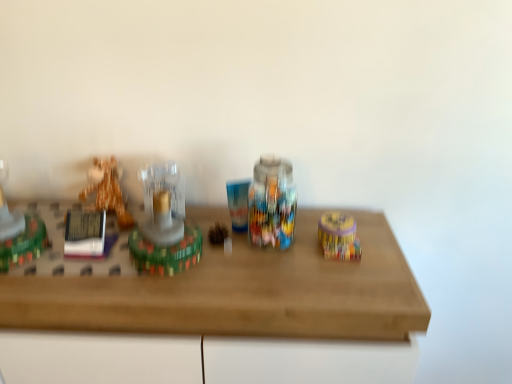
Question: Can you confirm if translucent glass candle at center, placed as the third toy when sorted from left to right, is thinner than matte yellow container at right, which ranks as the 4th toy in left-to-right order?

Choices:
 (A) yes
 (B) no

Answer: (B)

Question: Considering the relative sizes of translucent glass candle at center, placed as the third toy when sorted from left to right, and matte yellow container at right, which ranks as the 4th toy in left-to-right order, in the image provided, is translucent glass candle at center, placed as the third toy when sorted from left to right, taller than matte yellow container at right, which ranks as the 4th toy in left-to-right order,?

Choices:
 (A) yes
 (B) no

Answer: (A)

Question: Considering the relative positions of translucent glass candle at center, placed as the third toy when sorted from left to right, and matte yellow container at right, which ranks as the 4th toy in left-to-right order, in the image provided, is translucent glass candle at center, placed as the third toy when sorted from left to right, behind matte yellow container at right, which ranks as the 4th toy in left-to-right order,?

Choices:
 (A) yes
 (B) no

Answer: (B)

Question: From the image's perspective, is translucent glass candle at center, placed as the third toy when sorted from left to right, located above matte yellow container at right, which ranks as the 4th toy in left-to-right order?

Choices:
 (A) yes
 (B) no

Answer: (A)

Question: Can you confirm if translucent glass candle at center, positioned as the second toy in right-to-left order, is bigger than matte yellow container at right, which ranks as the 4th toy in left-to-right order?

Choices:
 (A) yes
 (B) no

Answer: (A)

Question: Considering the positions of shiny green plastic toy at left, acting as the 1th toy starting from the left, and wooden table at center in the image, is shiny green plastic toy at left, acting as the 1th toy starting from the left, wider or thinner than wooden table at center?

Choices:
 (A) thin
 (B) wide

Answer: (A)

Question: From a real-world perspective, is shiny green plastic toy at left, acting as the 1th toy starting from the left, positioned above or below wooden table at center?

Choices:
 (A) above
 (B) below

Answer: (A)

Question: From their relative heights in the image, would you say shiny green plastic toy at left, acting as the 1th toy starting from the left, is taller or shorter than wooden table at center?

Choices:
 (A) tall
 (B) short

Answer: (B)

Question: In terms of size, does shiny green plastic toy at left, which appears as the 4th toy when viewed from the right, appear bigger or smaller than wooden table at center?

Choices:
 (A) small
 (B) big

Answer: (A)

Question: Is wooden table at center taller or shorter than shiny green plastic toy at left, acting as the 1th toy starting from the left?

Choices:
 (A) short
 (B) tall

Answer: (B)

Question: Is wooden table at center spatially inside shiny green plastic toy at left, which appears as the 4th toy when viewed from the right, or outside of it?

Choices:
 (A) outside
 (B) inside

Answer: (A)

Question: Is point (423, 306) closer or farther from the camera than point (0, 226)?

Choices:
 (A) closer
 (B) farther

Answer: (A)

Question: From a real-world perspective, relative to shiny green plastic toy at left, which appears as the 4th toy when viewed from the right, is wooden table at center vertically above or below?

Choices:
 (A) above
 (B) below

Answer: (B)

Question: Considering the positions of matte yellow container at right, which ranks as the 4th toy in left-to-right order, and shiny green plastic toy at left, which appears as the 4th toy when viewed from the right, in the image, is matte yellow container at right, which ranks as the 4th toy in left-to-right order, taller or shorter than shiny green plastic toy at left, which appears as the 4th toy when viewed from the right,?

Choices:
 (A) short
 (B) tall

Answer: (A)

Question: Looking at the image, does matte yellow container at right, which is counted as the first toy, starting from the right, seem bigger or smaller compared to shiny green plastic toy at left, acting as the 1th toy starting from the left?

Choices:
 (A) big
 (B) small

Answer: (B)